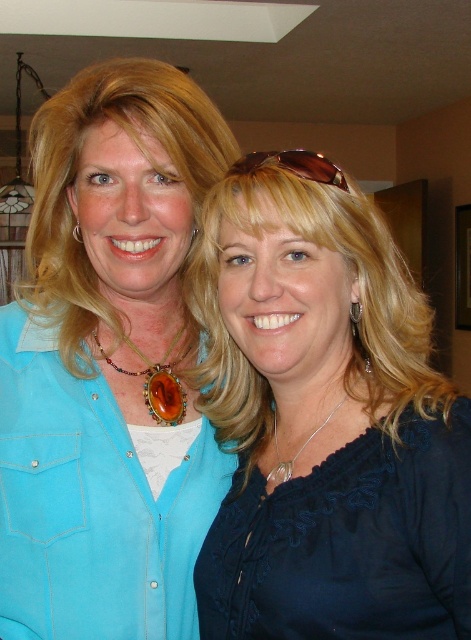
You are a photographer trying to capture a closeup of both the amber stone necklace at center and the silver metallic necklace at center. Since the camera can only focus on one necklace at a time, which one should you focus on first to ensure the taller necklace is in focus?

The silver metallic necklace at center is taller than the amber stone necklace at center, so you should focus on the silver metallic necklace at center first to ensure it is in focus.

Looking at this image, both women are wearing necklaces. The woman on the left has the amber stone necklace at center, and the woman on the right has the silver metallic necklace at center. Which necklace is positioned higher on its respective wearer?

The amber stone necklace at center is positioned higher than the silver metallic necklace at center.

You are a photographer adjusting the lighting for a portrait. You notice the amber stone necklace at center and the brown leather sunglasses at upper center in the frame. Which object appears closer to the left side of the frame?

The amber stone necklace at center is positioned on the left side of brown leather sunglasses at upper center, so it appears closer to the left side of the frame.